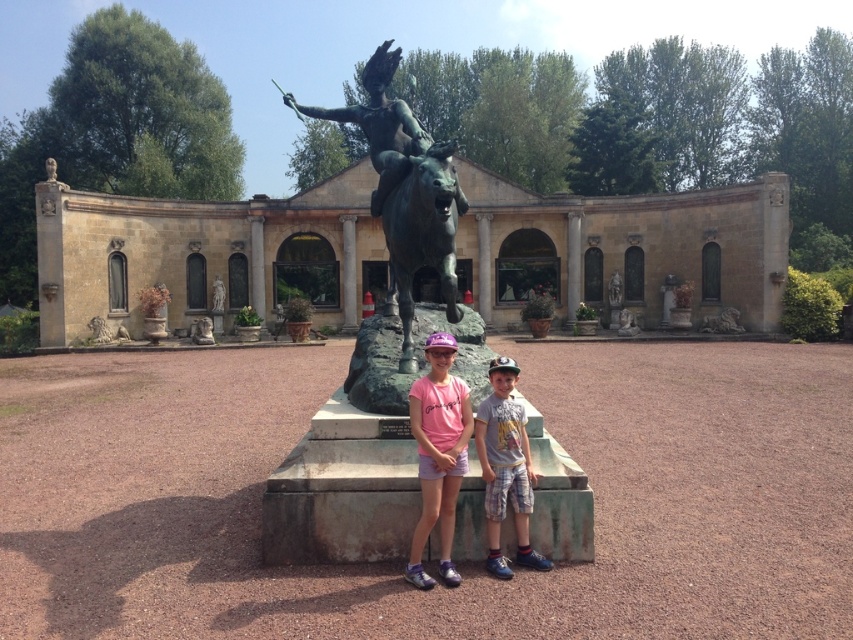
Question: Which object is farther from the camera taking this photo?

Choices:
 (A) stone building at center
 (B) pink fabric shirt at center
 (C) gray cotton shirt at center
 (D) bronze statue at center

Answer: (A)

Question: Which object is closer to the camera taking this photo?

Choices:
 (A) bronze statue at center
 (B) stone building at center

Answer: (A)

Question: Can you confirm if bronze statue at center is bigger than gray cotton shirt at center?

Choices:
 (A) yes
 (B) no

Answer: (A)

Question: Which object is positioned farthest from the stone building at center?

Choices:
 (A) gray cotton shirt at center
 (B) pink fabric shirt at center

Answer: (A)

Question: Is pink fabric shirt at center bigger than gray cotton shirt at center?

Choices:
 (A) no
 (B) yes

Answer: (A)

Question: Where is stone building at center located in relation to pink fabric shirt at center in the image?

Choices:
 (A) above
 (B) below

Answer: (A)